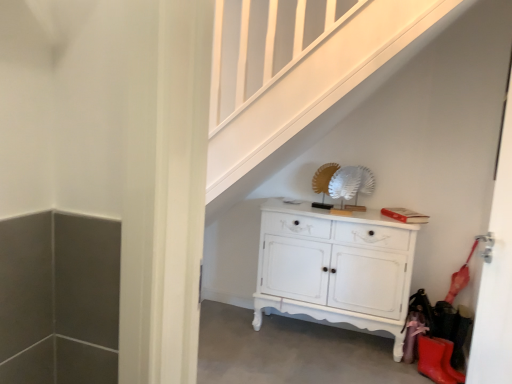
Question: Would you say rubber matte boot at lower right is a long distance from white painted wood cabinet at center?

Choices:
 (A) no
 (B) yes

Answer: (A)

Question: Is white painted wood cabinet at center completely or partially inside rubber matte boot at lower right?

Choices:
 (A) yes
 (B) no

Answer: (B)

Question: Does rubber matte boot at lower right have a lesser width compared to white painted wood cabinet at center?

Choices:
 (A) no
 (B) yes

Answer: (B)

Question: From a real-world perspective, is rubber matte boot at lower right beneath white painted wood cabinet at center?

Choices:
 (A) no
 (B) yes

Answer: (B)

Question: From the image's perspective, is rubber matte boot at lower right under white painted wood cabinet at center?

Choices:
 (A) no
 (B) yes

Answer: (B)

Question: Is the depth of rubber matte boot at lower right greater than that of white painted wood cabinet at center?

Choices:
 (A) no
 (B) yes

Answer: (A)

Question: Is rubber matte boot at lower right looking in the opposite direction of white glossy door at right?

Choices:
 (A) yes
 (B) no

Answer: (B)

Question: Can you see rubber matte boot at lower right touching white glossy door at right?

Choices:
 (A) no
 (B) yes

Answer: (A)

Question: Is rubber matte boot at lower right wider than white glossy door at right?

Choices:
 (A) yes
 (B) no

Answer: (A)

Question: Is rubber matte boot at lower right at the right side of white glossy door at right?

Choices:
 (A) no
 (B) yes

Answer: (B)

Question: Does rubber matte boot at lower right have a lesser width compared to white glossy door at right?

Choices:
 (A) yes
 (B) no

Answer: (B)

Question: Would you say rubber matte boot at lower right is a long distance from white glossy door at right?

Choices:
 (A) yes
 (B) no

Answer: (A)

Question: Considering the relative positions of white painted wood cabinet at center and white glossy door at right in the image provided, is white painted wood cabinet at center behind white glossy door at right?

Choices:
 (A) no
 (B) yes

Answer: (B)